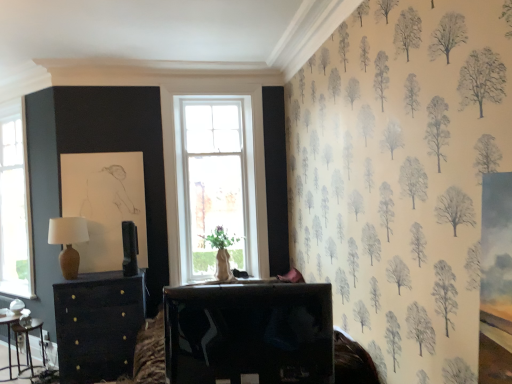
Question: Is matte black chest of drawers at left taller or shorter than matte brown table lamp at left?

Choices:
 (A) short
 (B) tall

Answer: (B)

Question: Considering their positions, is matte black chest of drawers at left located in front of or behind matte brown table lamp at left?

Choices:
 (A) front
 (B) behind

Answer: (A)

Question: Estimate the real-world distances between objects in this image. Which object is farther from the wooden table at lower left, positioned as the second table in right-to-left order?

Choices:
 (A) shiny black tv at center, placed as the 3th table when sorted from back to front
 (B) matte black chest of drawers at left
 (C) metallic silver table at lower left, positioned as the 1th table in left-to-right order
 (D) matte brown table lamp at left

Answer: (A)

Question: Based on their relative distances, which object is farther from the matte black chest of drawers at left?

Choices:
 (A) matte brown table lamp at left
 (B) shiny black tv at center, arranged as the first table when viewed from the right
 (C) wooden table at lower left, which is the 3th table in front-to-back order
 (D) metallic silver table at lower left, marked as the third table in a right-to-left arrangement

Answer: (B)